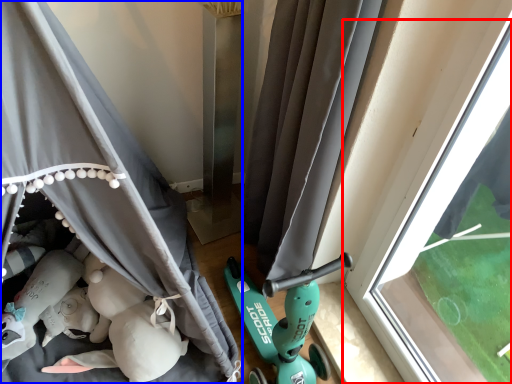
Question: Which point is closer to the camera, window (highlighted by a red box) or curtain (highlighted by a blue box)?

Choices:
 (A) window
 (B) curtain

Answer: (B)